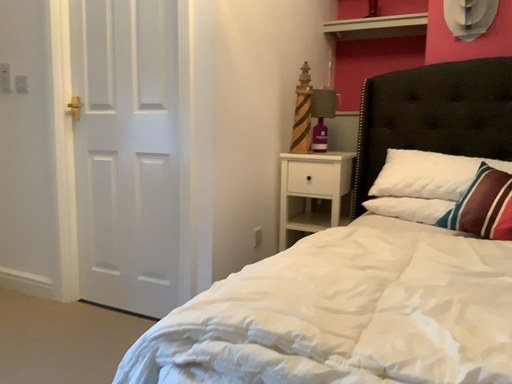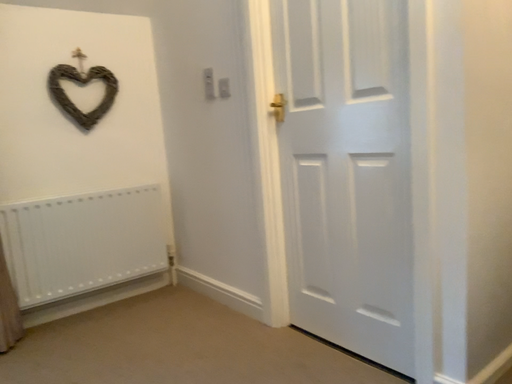
Question: How did the camera likely rotate when shooting the video?

Choices:
 (A) rotated right
 (B) rotated left

Answer: (B)